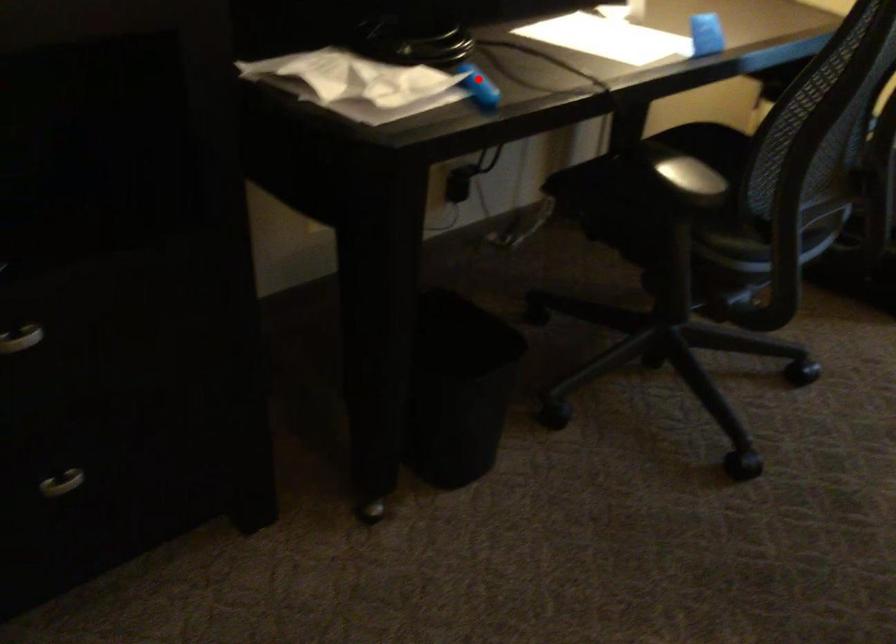
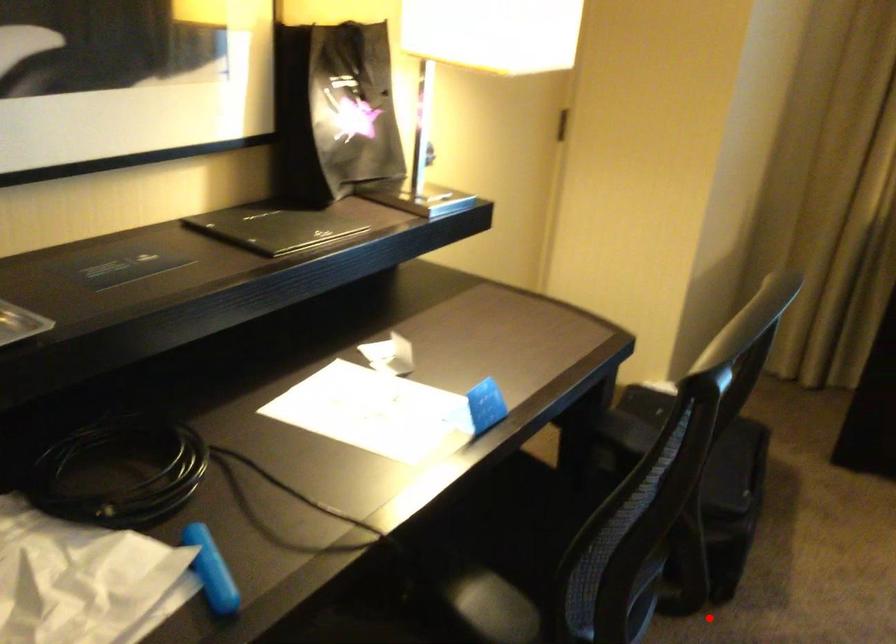
I am providing you with two images of the same scene from different viewpoints. A red point is marked on the first image and another point is marked on the second image. Are the points marked in image1 and image2 representing the same 3D position?

No